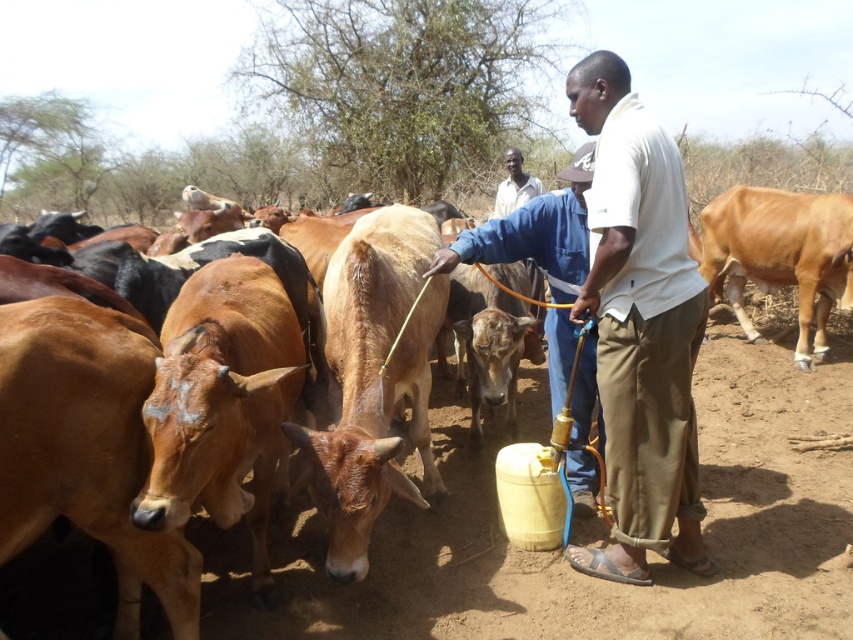
You are a drone operator flying a drone over a cattle ranch. Your drone is currently at a high altitude and you need to locate the white cotton shirt at center. According to the coordinates provided, where should you direct your drone to focus?

The white cotton shirt at center is located at coordinates point [640,326], so you should direct your drone to focus there.